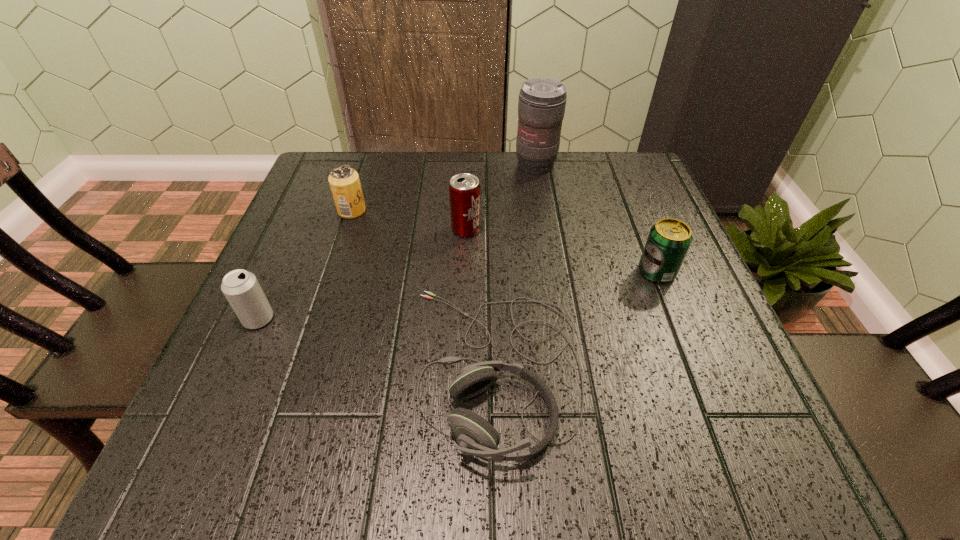
At what (x,y) coordinates should I click in order to perform the action: click on headset. Please return your answer as a coordinate pair (x, y). The height and width of the screenshot is (540, 960). Looking at the image, I should click on (476, 436).

Image resolution: width=960 pixels, height=540 pixels. What are the coordinates of `free region located on the side of the telephoto lens where the control switches are located` in the screenshot? It's located at (547, 238).

What are the coordinates of `vacant region located 0.140m on the front of the third farthest object` in the screenshot? It's located at (464, 286).

What are the coordinates of `free spot located 0.300m on the front of the rightmost object` in the screenshot? It's located at (718, 431).

What are the coordinates of `vacant space located on the right of the fifth nearest object` in the screenshot? It's located at (420, 211).

This screenshot has height=540, width=960. I want to click on free space located on the front of the nearest beer can, so click(229, 385).

At what (x,y) coordinates should I click in order to perform the action: click on free region located on the outer surface of the headset. Please return your answer as a coordinate pair (x, y). Looking at the image, I should click on (287, 369).

Identify the location of free space located 0.120m on the outer surface of the headset. This screenshot has width=960, height=540. (341, 369).

This screenshot has height=540, width=960. I want to click on free region located on the outer surface of the headset, so click(222, 369).

Locate an element on the screen. The height and width of the screenshot is (540, 960). telephoto lens present at the far edge is located at coordinates (541, 107).